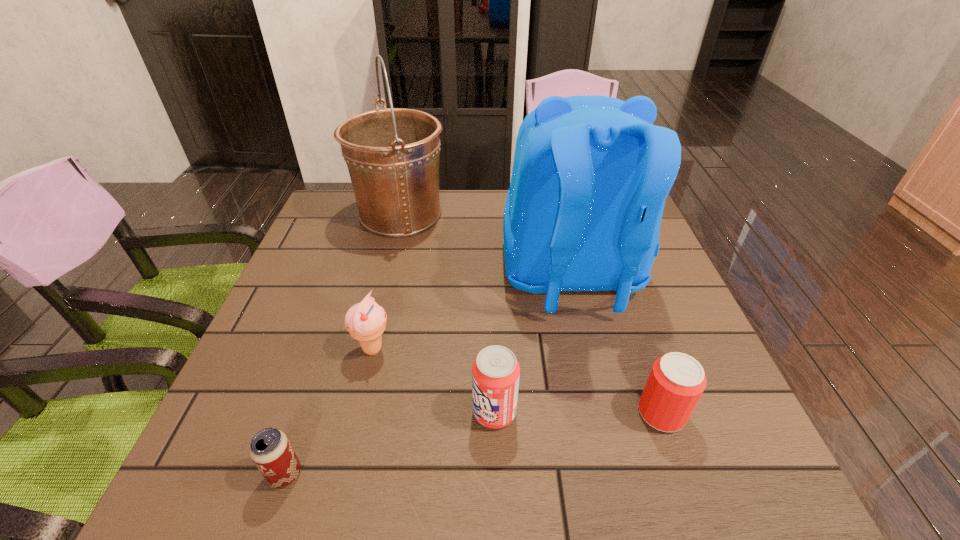
Identify the location of beer can that is at the left edge. The image size is (960, 540). (270, 449).

At what (x,y) coordinates should I click in order to perform the action: click on backpack present at the right edge. Please return your answer as a coordinate pair (x, y). Image resolution: width=960 pixels, height=540 pixels. Looking at the image, I should click on (591, 173).

Identify the location of beer can that is at the right edge. (676, 382).

The image size is (960, 540). Find the location of `object that is at the far left corner`. object that is at the far left corner is located at coordinates (392, 154).

Find the location of a particular element. object located at the near left corner is located at coordinates (270, 449).

This screenshot has width=960, height=540. Find the location of `object situated at the far right corner`. object situated at the far right corner is located at coordinates (591, 173).

Where is `vacant space at the near edge of the desktop`? vacant space at the near edge of the desktop is located at coordinates (376, 473).

In the image, there is a desktop. Identify the location of vacant space at the left edge. (336, 281).

In the image, there is a desktop. Where is `vacant region at the right edge`? Image resolution: width=960 pixels, height=540 pixels. vacant region at the right edge is located at coordinates (672, 283).

Identify the location of vacant region between the farther beer can and the soda can. (578, 413).